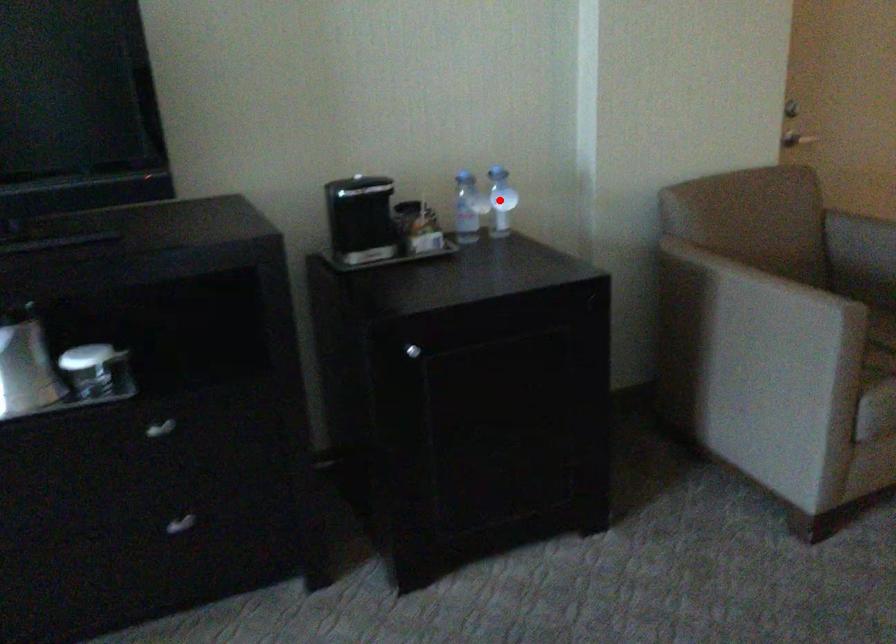
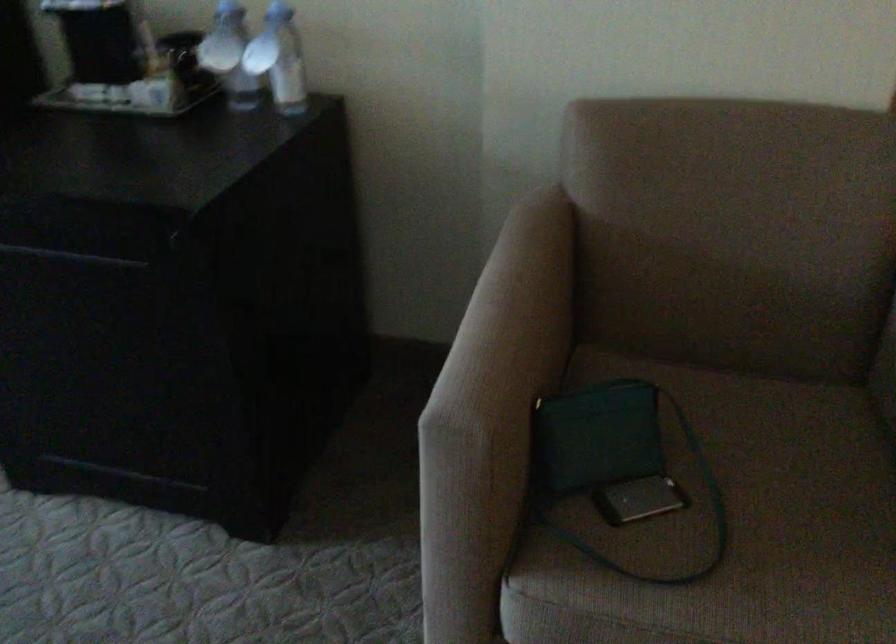
The point at the highlighted location is marked in the first image. Where is the corresponding point in the second image?

(279, 59)